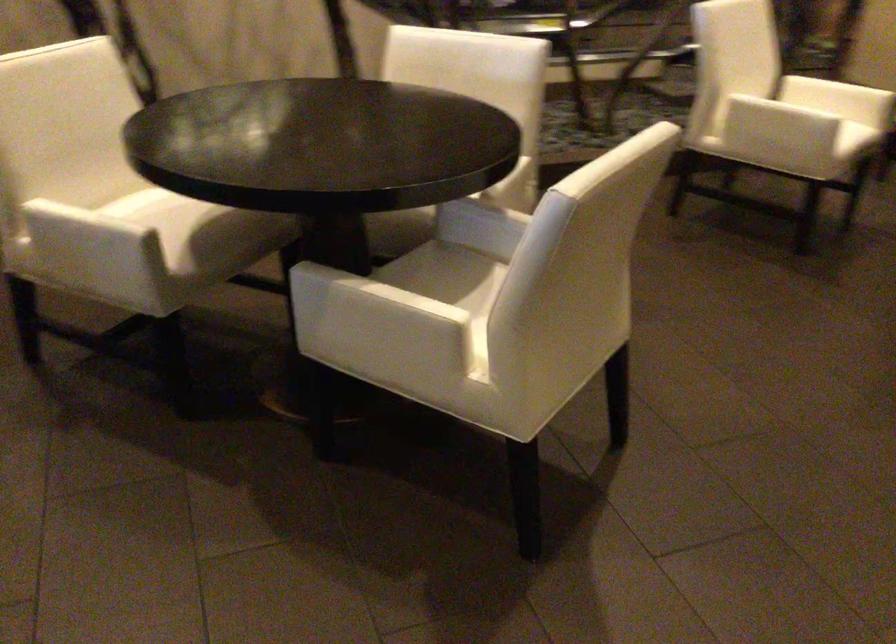
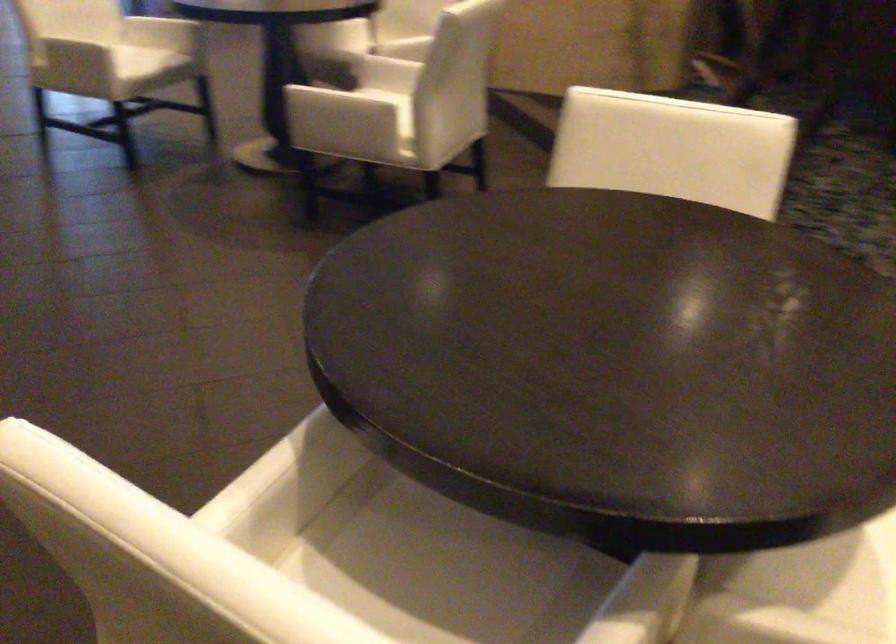
The point at (495, 202) is marked in the first image. Where is the corresponding point in the second image?

(643, 601)